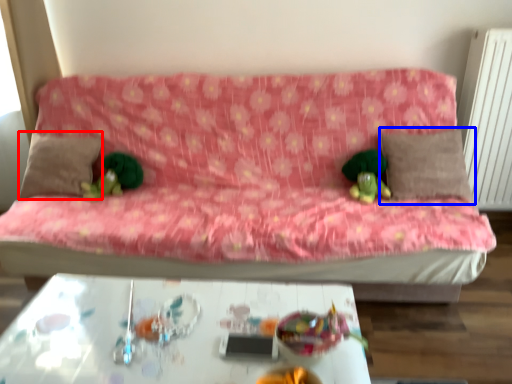
Question: Which object is closer to the camera taking this photo, pillow (highlighted by a red box) or pillow (highlighted by a blue box)?

Choices:
 (A) pillow
 (B) pillow

Answer: (B)